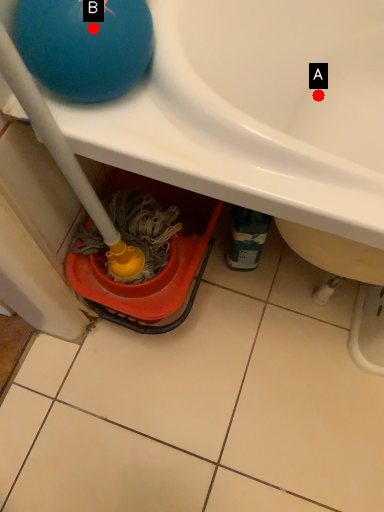
Question: Two points are circled on the image, labeled by A and B beside each circle. Which of the following is the closest to the observer?

Choices:
 (A) A is closer
 (B) B is closer

Answer: (B)